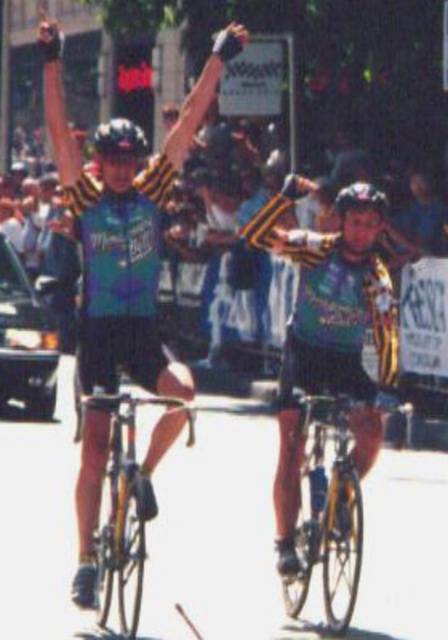
Does yellow matte bicycle at center have a larger size compared to shiny metallic bicycle at center?

No, yellow matte bicycle at center is not bigger than shiny metallic bicycle at center.

Can you confirm if yellow matte bicycle at center is positioned to the right of shiny metallic bicycle at center?

Indeed, yellow matte bicycle at center is positioned on the right side of shiny metallic bicycle at center.

Is point (314, 547) farther from camera compared to point (119, 532)?

That is True.

Where is `yellow matte bicycle at center`? Image resolution: width=448 pixels, height=640 pixels. yellow matte bicycle at center is located at coordinates (327, 509).

Is shiny metallic bicycle at center closer to the viewer compared to black matte bicycle helmet at upper center?

Yes, it is in front of black matte bicycle helmet at upper center.

Is shiny metallic bicycle at center shorter than black matte bicycle helmet at upper center?

Yes, shiny metallic bicycle at center is shorter than black matte bicycle helmet at upper center.

Is point (86, 396) closer to viewer compared to point (112, 132)?

Yes, point (86, 396) is in front of point (112, 132).

The height and width of the screenshot is (640, 448). I want to click on shiny metallic bicycle at center, so click(124, 509).

I want to click on yellow matte bicycle at center, so click(x=327, y=509).

Does yellow matte bicycle at center have a lesser width compared to black matte bicycle helmet at upper center?

Indeed, yellow matte bicycle at center has a lesser width compared to black matte bicycle helmet at upper center.

Does point (315, 465) come closer to viewer compared to point (98, 129)?

That is True.

Locate an element on the screen. yellow matte bicycle at center is located at coordinates (327, 509).